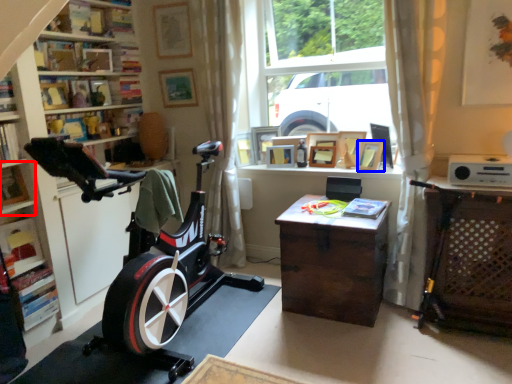
Question: Which of the following is the closest to the observer, shelf (highlighted by a red box) or picture frame (highlighted by a blue box)?

Choices:
 (A) shelf
 (B) picture frame

Answer: (A)